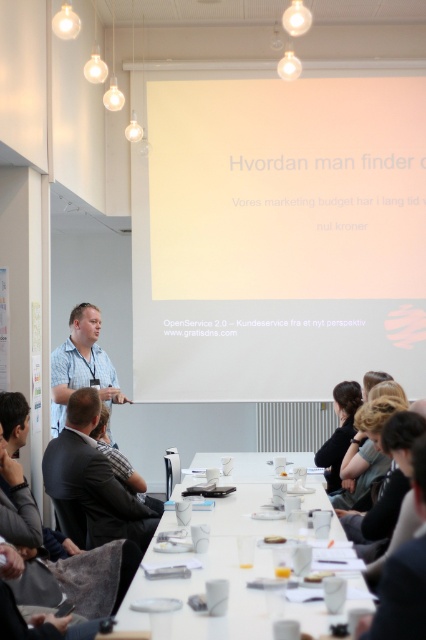
Question: Which point is farther to the camera?

Choices:
 (A) (296, 611)
 (B) (368, 353)
 (C) (106, 376)

Answer: (B)

Question: Which of the following is the farthest from the observer?

Choices:
 (A) dark gray suit at lower left
 (B) blue checkered shirt at left

Answer: (B)

Question: Observing the image, what is the correct spatial positioning of white matte projector screen at upper center in reference to blue checkered shirt at left?

Choices:
 (A) below
 (B) above

Answer: (B)

Question: Is white glossy table at center closer to the viewer compared to dark gray suit at lower left?

Choices:
 (A) no
 (B) yes

Answer: (B)

Question: Is dark gray suit at lower left further to the viewer compared to blue checkered shirt at left?

Choices:
 (A) no
 (B) yes

Answer: (A)

Question: Which of the following is the closest to the observer?

Choices:
 (A) blue checkered shirt at left
 (B) white matte projector screen at upper center

Answer: (A)